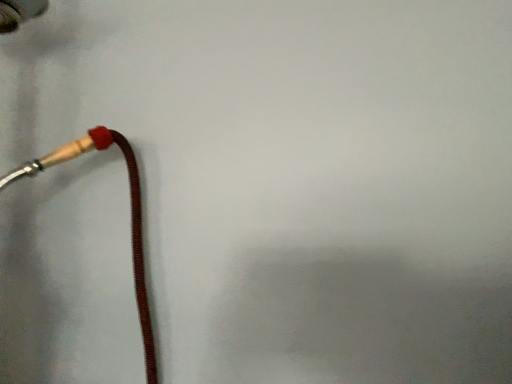
The image size is (512, 384). Identify the location of rubber hose at left. (131, 218).

This screenshot has height=384, width=512. Describe the element at coordinates (131, 218) in the screenshot. I see `rubber hose at left` at that location.

The height and width of the screenshot is (384, 512). I want to click on rubber hose at left, so click(131, 218).